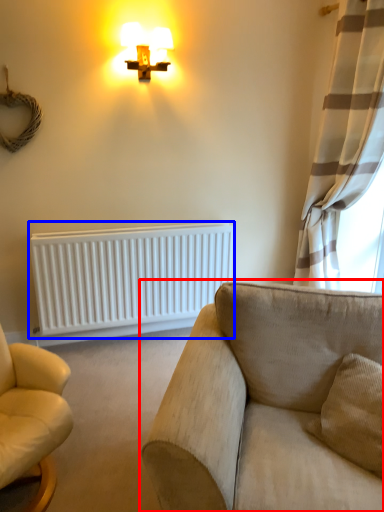
Question: Which object appears farthest to the camera in this image, studio couch (highlighted by a red box) or radiator (highlighted by a blue box)?

Choices:
 (A) studio couch
 (B) radiator

Answer: (B)